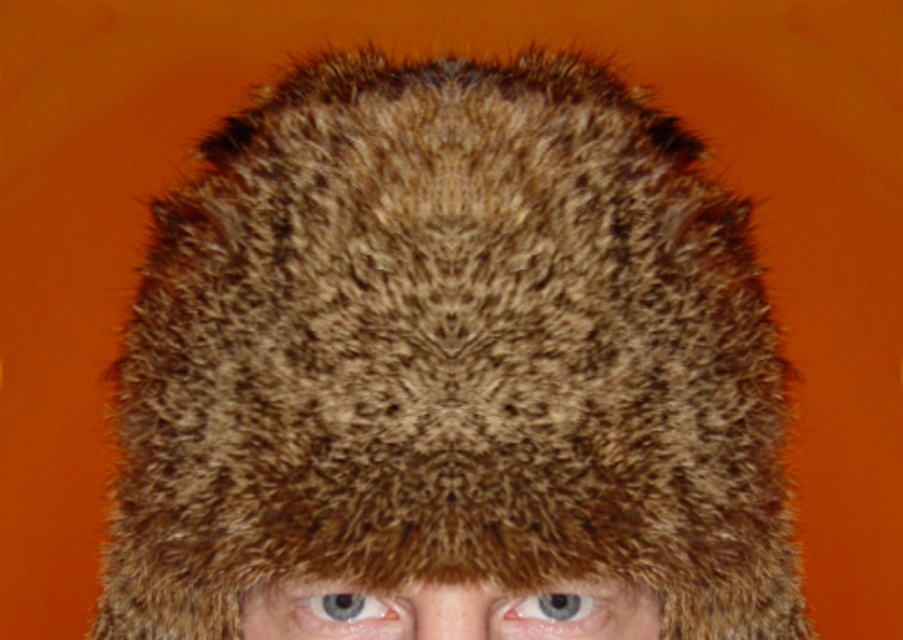
This screenshot has width=903, height=640. Find the location of `blue glossy eye at center`. blue glossy eye at center is located at coordinates pos(557,611).

In the scene shown: Who is higher up, blue glossy eye at center or blue iridescent eye at center?

blue glossy eye at center

Between point (592, 604) and point (320, 627), which one is positioned in front?

Point (320, 627) is in front.

The height and width of the screenshot is (640, 903). I want to click on blue glossy eye at center, so pos(557,611).